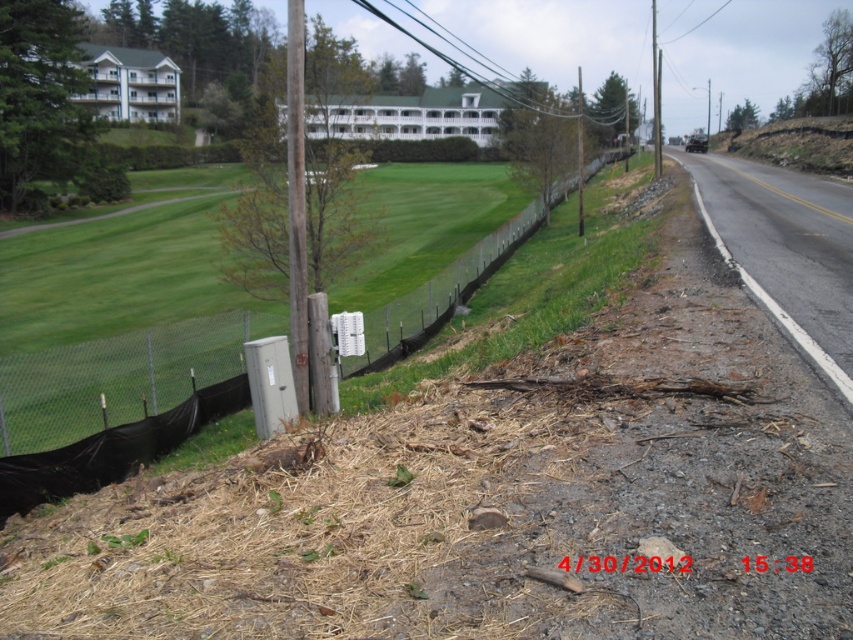
From the picture: You are standing at the camera position and see two points in the scene. The first point is at coordinates point (47, 490) and the second is at point (577, 195). Which point is closer to you?

Point (47, 490) is closer to the camera than point (577, 195).